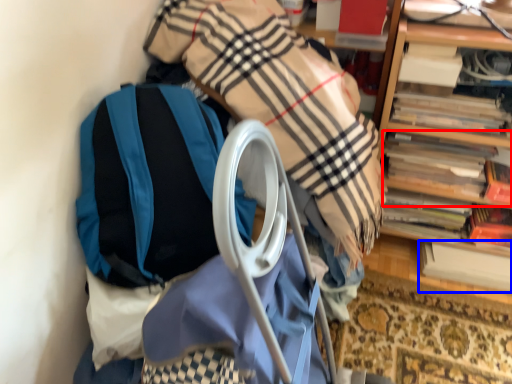
Question: Which point is closer to the camera, book (highlighted by a red box) or book (highlighted by a blue box)?

Choices:
 (A) book
 (B) book

Answer: (A)